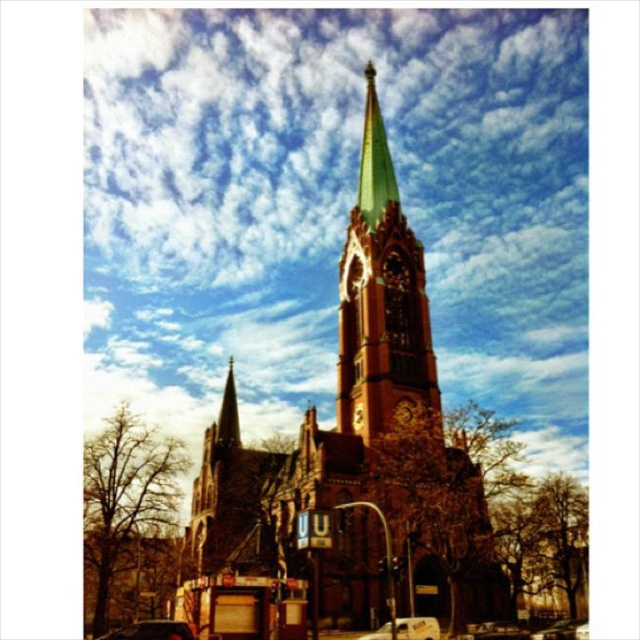
Question: Can you confirm if green glass spire at upper center is positioned above metallic silver car at center?

Choices:
 (A) no
 (B) yes

Answer: (B)

Question: Is green glass spire at upper center further to the viewer compared to metallic silver car at center?

Choices:
 (A) no
 (B) yes

Answer: (B)

Question: Among these objects, which one is nearest to the camera?

Choices:
 (A) golden metallic clock at center
 (B) metallic silver car at center

Answer: (B)

Question: Which point appears farthest from the camera in this image?

Choices:
 (A) (488, 636)
 (B) (365, 102)

Answer: (B)

Question: Can you confirm if brown brick church at center is positioned to the left of green glass spire at center?

Choices:
 (A) no
 (B) yes

Answer: (B)

Question: Estimate the real-world distances between objects in this image. Which object is closer to the brown brick church at center?

Choices:
 (A) metallic silver car at center
 (B) white plastic car at lower center
 (C) green glass spire at upper center
 (D) golden metallic clock at center

Answer: (B)